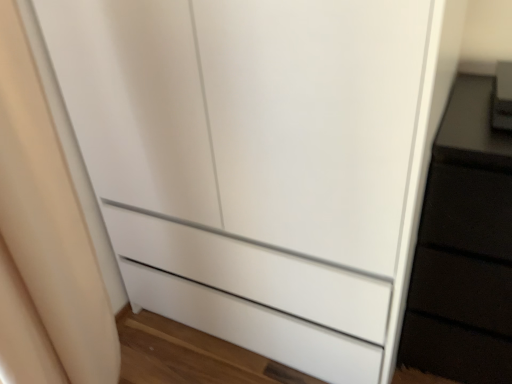
Question: In the image, is beige fabric curtain at left positioned in front of or behind satin black phone at upper right?

Choices:
 (A) front
 (B) behind

Answer: (A)

Question: From the image's perspective, is beige fabric curtain at left above or below satin black phone at upper right?

Choices:
 (A) below
 (B) above

Answer: (A)

Question: Considering the positions of point (17, 132) and point (507, 115), is point (17, 132) closer or farther from the camera than point (507, 115)?

Choices:
 (A) farther
 (B) closer

Answer: (B)

Question: Considering the positions of satin black phone at upper right and beige fabric curtain at left in the image, is satin black phone at upper right wider or thinner than beige fabric curtain at left?

Choices:
 (A) wide
 (B) thin

Answer: (B)

Question: Is point (503, 67) positioned closer to the camera than point (15, 165)?

Choices:
 (A) farther
 (B) closer

Answer: (A)

Question: Considering the positions of satin black phone at upper right and beige fabric curtain at left in the image, is satin black phone at upper right taller or shorter than beige fabric curtain at left?

Choices:
 (A) short
 (B) tall

Answer: (A)

Question: Considering the relative positions of satin black phone at upper right and beige fabric curtain at left in the image provided, is satin black phone at upper right to the left or to the right of beige fabric curtain at left?

Choices:
 (A) right
 (B) left

Answer: (A)